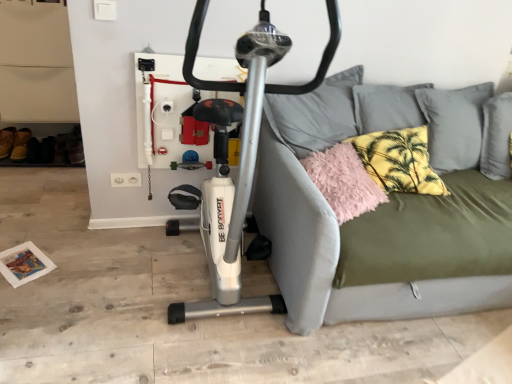
Question: Is olive green fabric studio couch at center positioned far away from fluffy pink pillow at right, which is counted as the first pillow, starting from the left?

Choices:
 (A) no
 (B) yes

Answer: (A)

Question: Is fluffy pink pillow at right, the second pillow viewed from the right, inside olive green fabric studio couch at center?

Choices:
 (A) yes
 (B) no

Answer: (A)

Question: Considering the relative sizes of olive green fabric studio couch at center and fluffy pink pillow at right, the second pillow viewed from the right, in the image provided, is olive green fabric studio couch at center bigger than fluffy pink pillow at right, the second pillow viewed from the right,?

Choices:
 (A) yes
 (B) no

Answer: (A)

Question: Is olive green fabric studio couch at center to the left of fluffy pink pillow at right, which is counted as the first pillow, starting from the left, from the viewer's perspective?

Choices:
 (A) no
 (B) yes

Answer: (A)

Question: From the image's perspective, would you say olive green fabric studio couch at center is positioned over fluffy pink pillow at right, which is counted as the first pillow, starting from the left?

Choices:
 (A) no
 (B) yes

Answer: (A)

Question: From a real-world perspective, relative to olive green fabric studio couch at center, is fluffy pink pillow at right, which is counted as the first pillow, starting from the left, vertically above or below?

Choices:
 (A) above
 (B) below

Answer: (A)

Question: Is fluffy pink pillow at right, the second pillow viewed from the right, taller or shorter than olive green fabric studio couch at center?

Choices:
 (A) tall
 (B) short

Answer: (B)

Question: Does point click(351, 170) appear closer or farther from the camera than point click(464, 309)?

Choices:
 (A) closer
 (B) farther

Answer: (A)

Question: In the image, is fluffy pink pillow at right, the second pillow viewed from the right, positioned in front of or behind olive green fabric studio couch at center?

Choices:
 (A) behind
 (B) front

Answer: (A)

Question: From the image's perspective, relative to yellow palm-patterned pillow at upper right, the 1th pillow viewed from the right, is olive green fabric studio couch at center above or below?

Choices:
 (A) below
 (B) above

Answer: (A)

Question: Choose the correct answer: Is olive green fabric studio couch at center inside yellow palm-patterned pillow at upper right, the 2th pillow in the left-to-right sequence, or outside it?

Choices:
 (A) outside
 (B) inside

Answer: (A)

Question: Would you say olive green fabric studio couch at center is to the left or to the right of yellow palm-patterned pillow at upper right, the 1th pillow viewed from the right, in the picture?

Choices:
 (A) left
 (B) right

Answer: (B)

Question: In terms of height, does olive green fabric studio couch at center look taller or shorter compared to yellow palm-patterned pillow at upper right, the 1th pillow viewed from the right?

Choices:
 (A) short
 (B) tall

Answer: (B)

Question: Based on their sizes in the image, would you say olive green fabric studio couch at center is bigger or smaller than brown suede shoe at lower left?

Choices:
 (A) small
 (B) big

Answer: (B)

Question: In the image, is olive green fabric studio couch at center on the left side or the right side of brown suede shoe at lower left?

Choices:
 (A) left
 (B) right

Answer: (B)